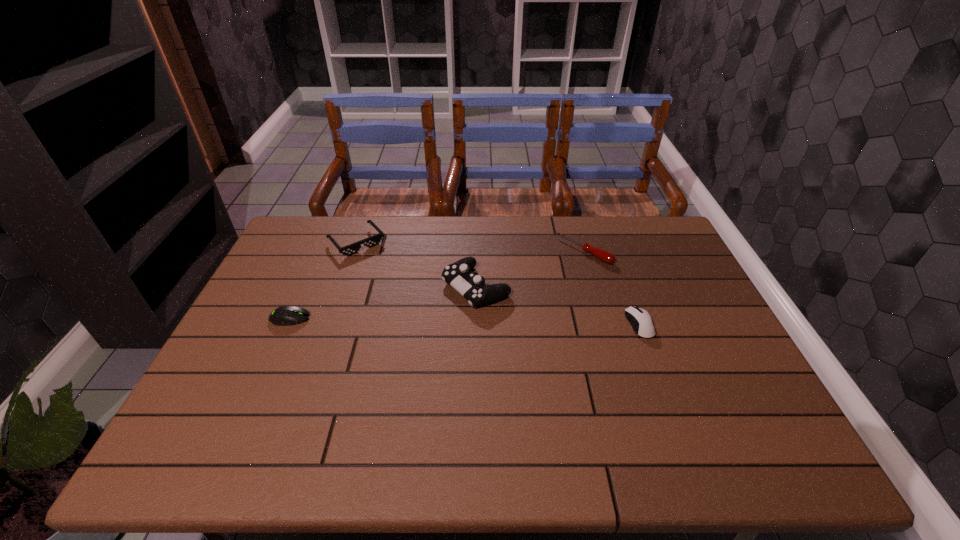
In order to click on sunglasses at the left edge in this screenshot , I will do `click(374, 240)`.

I want to click on object at the far left corner, so click(374, 240).

This screenshot has height=540, width=960. What are the coordinates of `free location at the far edge of the desktop` in the screenshot? It's located at (440, 247).

In the image, there is a desktop. At what (x,y) coordinates should I click in order to perform the action: click on blank space at the near edge. Please return your answer as a coordinate pair (x, y). Looking at the image, I should click on (492, 408).

Locate an element on the screen. The width and height of the screenshot is (960, 540). vacant area at the left edge is located at coordinates (237, 373).

Find the location of a particular element. The height and width of the screenshot is (540, 960). vacant space at the far right corner is located at coordinates (646, 219).

The image size is (960, 540). In order to click on vacant area that lies between the control and the right mouse in this screenshot , I will do `click(558, 306)`.

This screenshot has height=540, width=960. I want to click on vacant area between the screwdriver and the sunglasses, so click(470, 247).

Where is `vacant space in between the screwdriver and the tallest object`? This screenshot has width=960, height=540. vacant space in between the screwdriver and the tallest object is located at coordinates (530, 269).

At what (x,y) coordinates should I click in order to perform the action: click on blank region between the screwdriver and the right mouse. Please return your answer as a coordinate pair (x, y). Looking at the image, I should click on (612, 288).